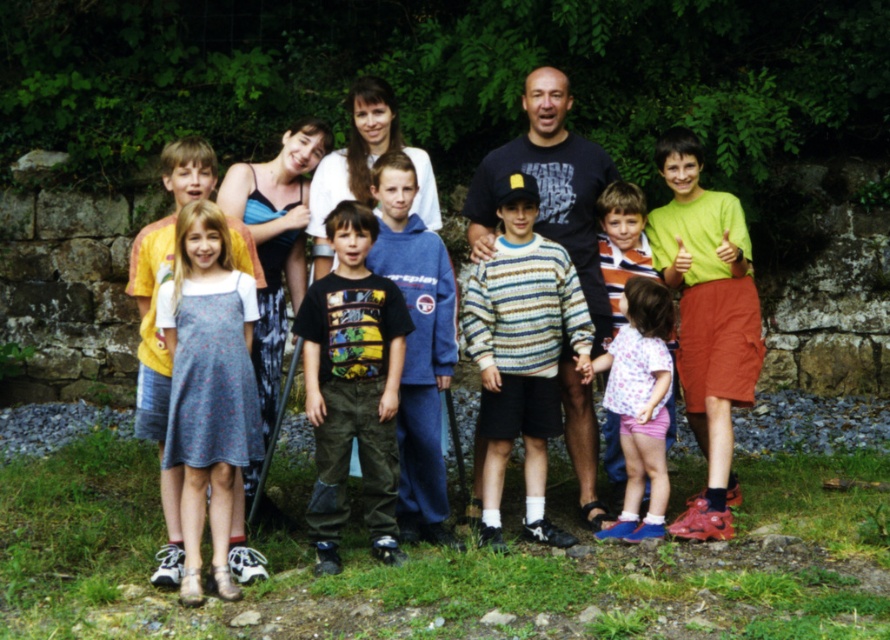
You are a photographer adjusting the lighting for a family photo. You notice the dress fabric at left and the printed cotton shirt at center. Which clothing item is positioned lower in the image?

The dress fabric at left is located below the printed cotton shirt at center, so it is positioned lower in the image.